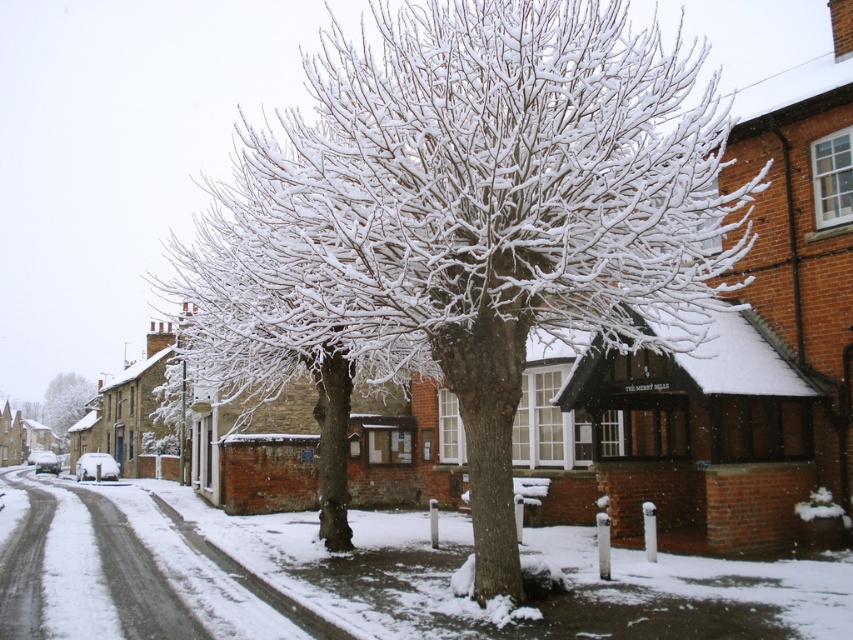
Question: Does snow-covered branches at center appear on the right side of white powdery snow at center?

Choices:
 (A) yes
 (B) no

Answer: (A)

Question: Is snow-covered branches at center further to camera compared to white frosty tree at left?

Choices:
 (A) yes
 (B) no

Answer: (B)

Question: Does snow-covered branches at center appear over white powdery snow at center?

Choices:
 (A) no
 (B) yes

Answer: (B)

Question: Among these objects, which one is farthest from the camera?

Choices:
 (A) white powdery snow at center
 (B) white frosty tree at left
 (C) snow-covered branches at center

Answer: (B)

Question: Which point is farther from the camera taking this photo?

Choices:
 (A) (70, 378)
 (B) (134, 556)

Answer: (A)

Question: Which point is closer to the camera taking this photo?

Choices:
 (A) (73, 413)
 (B) (109, 528)
 (C) (370, 369)

Answer: (B)